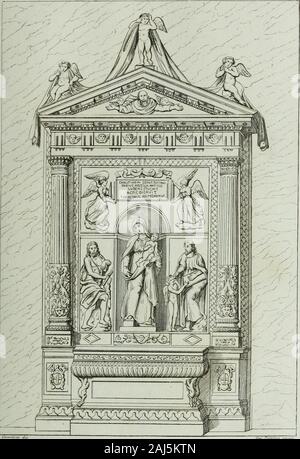
Locate an element on the screen. The width and height of the screenshot is (300, 459). pillars is located at coordinates (223, 206), (60, 216).